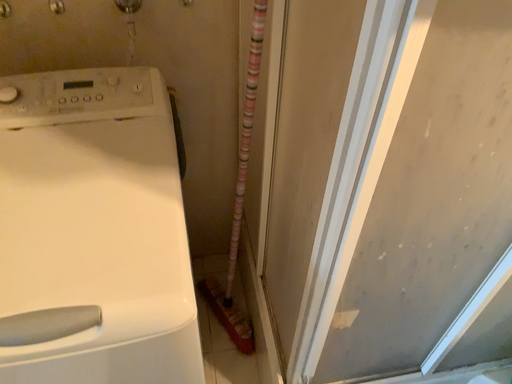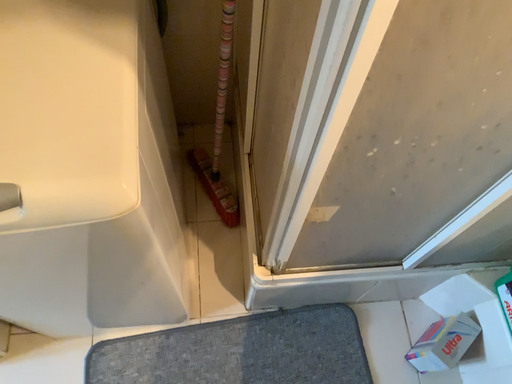
Question: How did the camera likely rotate when shooting the video?

Choices:
 (A) rotated upward
 (B) rotated downward

Answer: (B)